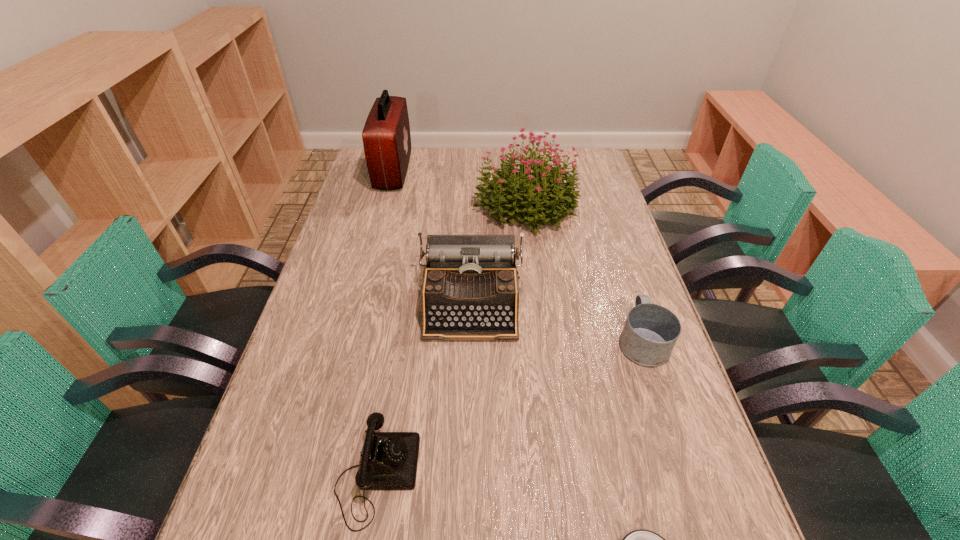
Identify the location of the first aid kit. (386, 136).

Where is `bouquet`? Image resolution: width=960 pixels, height=540 pixels. bouquet is located at coordinates (540, 193).

This screenshot has width=960, height=540. What are the coordinates of `typewriter` in the screenshot? It's located at (470, 291).

Identify the location of the rightmost object. (650, 332).

The image size is (960, 540). In order to click on telephone in this screenshot , I will do `click(389, 461)`.

Locate an element on the screen. The image size is (960, 540). blank space located on the side of the first aid kit with the cross symbol is located at coordinates (428, 171).

Where is `vacant space situated 0.220m on the front of the bouquet`? The image size is (960, 540). vacant space situated 0.220m on the front of the bouquet is located at coordinates (536, 287).

Find the location of a particular element. Image resolution: width=960 pixels, height=540 pixels. vacant area situated on the keyboard of the fourth shortest object is located at coordinates (468, 462).

At what (x,y) coordinates should I click in order to perform the action: click on vacant point located 0.290m on the side of the mug with the handle. Please return your answer as a coordinate pair (x, y). This screenshot has width=960, height=540. Looking at the image, I should click on (611, 245).

At what (x,y) coordinates should I click in order to perform the action: click on vacant area situated on the side of the mug with the handle. Please return your answer as a coordinate pair (x, y). Looking at the image, I should click on (606, 231).